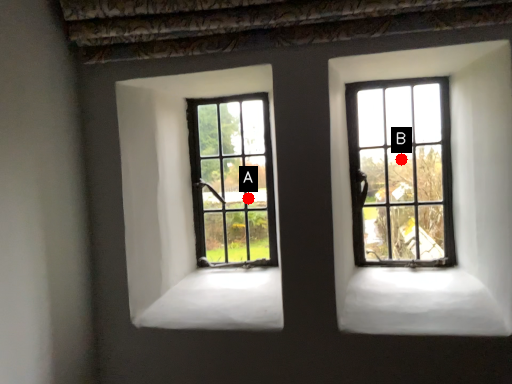
Question: Two points are circled on the image, labeled by A and B beside each circle. Among these points, which one is farthest from the camera?

Choices:
 (A) A is further
 (B) B is further

Answer: (A)